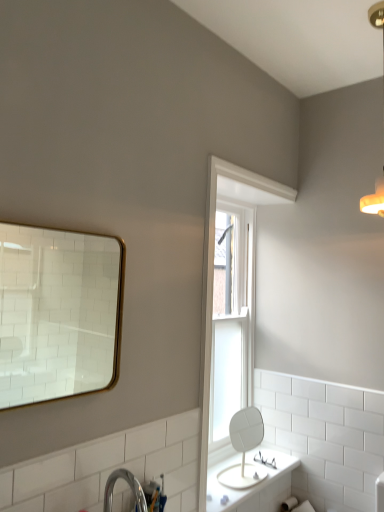
Locate an element on the screen. This screenshot has width=384, height=512. white glossy mirror at center, placed as the 1th mirror when sorted from bottom to top is located at coordinates (244, 448).

Measure the distance between clear plastic glasses at center and camera.

A distance of 7.28 feet exists between clear plastic glasses at center and camera.

Locate an element on the screen. The width and height of the screenshot is (384, 512). white glossy mirror at center, placed as the 1th mirror when sorted from bottom to top is located at coordinates (244, 448).

Is warm matte light fixture at upper right taller or shorter than gold-framed mirror at upper left, arranged as the 2th mirror when viewed from the right?

Clearly, warm matte light fixture at upper right is taller compared to gold-framed mirror at upper left, arranged as the 2th mirror when viewed from the right.

From the image's perspective, who appears lower, warm matte light fixture at upper right or gold-framed mirror at upper left, the 2th mirror in the bottom-to-top sequence?

gold-framed mirror at upper left, the 2th mirror in the bottom-to-top sequence, is shown below in the image.

Can you confirm if warm matte light fixture at upper right is wider than gold-framed mirror at upper left, arranged as the first mirror when viewed from the front?

Yes.

Would you say warm matte light fixture at upper right is inside or outside gold-framed mirror at upper left, arranged as the 2th mirror when viewed from the right?

The correct answer is: outside.

Where is `window above the white glossy mirror at center, acting as the 2th mirror starting from the top (from the image's perspective)`? The height and width of the screenshot is (512, 384). window above the white glossy mirror at center, acting as the 2th mirror starting from the top (from the image's perspective) is located at coordinates (233, 329).

Is clear glass window at center positioned behind white glossy mirror at center, acting as the 2th mirror starting from the top?

Yes, it is behind white glossy mirror at center, acting as the 2th mirror starting from the top.

Is clear glass window at center next to white glossy mirror at center, the 2th mirror from the front?

There is a gap between clear glass window at center and white glossy mirror at center, the 2th mirror from the front.

From the image's perspective, which one is positioned higher, clear glass window at center or white glossy mirror at center, the second mirror when ordered from left to right?

clear glass window at center appears higher in the image.

In the image, is clear glass window at center positioned in front of or behind gold-framed mirror at upper left, arranged as the first mirror when viewed from the front?

clear glass window at center is behind gold-framed mirror at upper left, arranged as the first mirror when viewed from the front.

In the scene shown: From the image's perspective, between clear glass window at center and gold-framed mirror at upper left, arranged as the 2th mirror when viewed from the right, who is located below?

clear glass window at center is shown below in the image.

Considering the relative positions of clear glass window at center and gold-framed mirror at upper left, arranged as the 2th mirror when viewed from the right, in the image provided, is clear glass window at center to the left or to the right of gold-framed mirror at upper left, arranged as the 2th mirror when viewed from the right,?

Clearly, clear glass window at center is on the right of gold-framed mirror at upper left, arranged as the 2th mirror when viewed from the right, in the image.

Is clear glass window at center touching gold-framed mirror at upper left, arranged as the first mirror when viewed from the front?

No, clear glass window at center is not next to gold-framed mirror at upper left, arranged as the first mirror when viewed from the front.

From the image's perspective, is gold-framed mirror at upper left, the 1th mirror when ordered from left to right, positioned above or below clear plastic glasses at center?

From the image's perspective, gold-framed mirror at upper left, the 1th mirror when ordered from left to right, appears above clear plastic glasses at center.

How much distance is there between gold-framed mirror at upper left, the 1th mirror when ordered from left to right, and clear plastic glasses at center?

They are 6.49 feet apart.

Can you see gold-framed mirror at upper left, the 2th mirror positioned from the back, touching clear plastic glasses at center?

gold-framed mirror at upper left, the 2th mirror positioned from the back, and clear plastic glasses at center are clearly separated.

Is gold-framed mirror at upper left, arranged as the first mirror when viewed from the front, turned away from clear plastic glasses at center?

That's not correct — gold-framed mirror at upper left, arranged as the first mirror when viewed from the front, is not looking away from clear plastic glasses at center.

Is clear plastic glasses at center wider or thinner than gold-framed mirror at upper left, arranged as the 2th mirror when viewed from the right?

Clearly, clear plastic glasses at center has more width compared to gold-framed mirror at upper left, arranged as the 2th mirror when viewed from the right.

From the picture: Considering the relative sizes of clear plastic glasses at center and gold-framed mirror at upper left, the 2th mirror positioned from the back, in the image provided, is clear plastic glasses at center shorter than gold-framed mirror at upper left, the 2th mirror positioned from the back,?

Indeed, clear plastic glasses at center has a lesser height compared to gold-framed mirror at upper left, the 2th mirror positioned from the back.

From the image's perspective, does clear plastic glasses at center appear higher than gold-framed mirror at upper left, the 2th mirror in the bottom-to-top sequence?

No.

The width and height of the screenshot is (384, 512). Identify the location of plumbing fixture directly beneath the gold-framed mirror at upper left, the first mirror from the top (from a real-world perspective). (265, 460).

Is gold-framed mirror at upper left, arranged as the 2th mirror when viewed from the right, positioned before white painted wood window frame at upper center?

Yes, it is in front of white painted wood window frame at upper center.

Between gold-framed mirror at upper left, arranged as the 2th mirror when viewed from the right, and white painted wood window frame at upper center, which one appears on the right side from the viewer's perspective?

white painted wood window frame at upper center is more to the right.

How many degrees apart are the facing directions of gold-framed mirror at upper left, arranged as the 2th mirror when viewed from the right, and white painted wood window frame at upper center?

They differ by 0.0964 degrees in their facing directions.

Image resolution: width=384 pixels, height=512 pixels. What are the coordinates of `mirror lying above the white painted wood window frame at upper center (from the image's perspective)` in the screenshot? It's located at (58, 313).

Would you consider clear plastic glasses at center to be distant from warm matte light fixture at upper right?

Yes, clear plastic glasses at center is far from warm matte light fixture at upper right.

Is clear plastic glasses at center at the left side of warm matte light fixture at upper right?

Yes.

Is clear plastic glasses at center completely or partially outside of warm matte light fixture at upper right?

Yes.

Based on the photo, does clear plastic glasses at center have a smaller size compared to warm matte light fixture at upper right?

Yes, clear plastic glasses at center is smaller than warm matte light fixture at upper right.

This screenshot has height=512, width=384. I want to click on light fixture located above the gold-framed mirror at upper left, arranged as the first mirror when viewed from the front (from the image's perspective), so click(x=383, y=127).

Where is `window above the white glossy mirror at center, placed as the 1th mirror when sorted from bottom to top (from a real-world perspective)`? window above the white glossy mirror at center, placed as the 1th mirror when sorted from bottom to top (from a real-world perspective) is located at coordinates (233, 329).

Which object lies further to the anchor point white glossy mirror at center, placed as the 1th mirror when sorted from bottom to top, warm matte light fixture at upper right or clear plastic glasses at center?

warm matte light fixture at upper right is positioned further to the anchor white glossy mirror at center, placed as the 1th mirror when sorted from bottom to top.

Estimate the real-world distances between objects in this image. Which object is further from white painted wood window frame at upper center, clear glass window at center or warm matte light fixture at upper right?

warm matte light fixture at upper right is positioned further to the anchor white painted wood window frame at upper center.

Based on their spatial positions, is clear glass window at center or clear plastic glasses at center closer to warm matte light fixture at upper right?

clear glass window at center is closer to warm matte light fixture at upper right.

Based on their spatial positions, is clear plastic glasses at center or white painted wood window frame at upper center closer to gold-framed mirror at upper left, the 1th mirror when ordered from left to right?

white painted wood window frame at upper center is closer to gold-framed mirror at upper left, the 1th mirror when ordered from left to right.

Which object lies further to the anchor point gold-framed mirror at upper left, arranged as the 2th mirror when viewed from the right, warm matte light fixture at upper right or clear plastic glasses at center?

The object further to gold-framed mirror at upper left, arranged as the 2th mirror when viewed from the right, is warm matte light fixture at upper right.

When comparing their distances from clear glass window at center, does warm matte light fixture at upper right or white glossy mirror at center, acting as the 2th mirror starting from the top, seem further?

The object further to clear glass window at center is warm matte light fixture at upper right.

From the image, which object appears to be farther from gold-framed mirror at upper left, the 1th mirror when ordered from left to right, warm matte light fixture at upper right or white painted wood window frame at upper center?

warm matte light fixture at upper right is further to gold-framed mirror at upper left, the 1th mirror when ordered from left to right.

In the scene shown: Which object lies further to the anchor point white glossy mirror at center, the 1th mirror when ordered from back to front, clear plastic glasses at center or gold-framed mirror at upper left, the 1th mirror when ordered from left to right?

The object further to white glossy mirror at center, the 1th mirror when ordered from back to front, is gold-framed mirror at upper left, the 1th mirror when ordered from left to right.

What are the coordinates of `window between gold-framed mirror at upper left, arranged as the 2th mirror when viewed from the right, and warm matte light fixture at upper right, in the horizontal direction` in the screenshot? It's located at (233, 329).

Where is `window between warm matte light fixture at upper right and white glossy mirror at center, placed as the 1th mirror when sorted from bottom to top, in the vertical direction`? The height and width of the screenshot is (512, 384). window between warm matte light fixture at upper right and white glossy mirror at center, placed as the 1th mirror when sorted from bottom to top, in the vertical direction is located at coordinates (233, 329).

Locate an element on the screen. This screenshot has height=512, width=384. mirror between gold-framed mirror at upper left, the 2th mirror positioned from the back, and clear plastic glasses at center from front to back is located at coordinates (244, 448).

This screenshot has height=512, width=384. Identify the location of window frame located between gold-framed mirror at upper left, the first mirror from the top, and white glossy mirror at center, acting as the 2th mirror starting from the top, in the depth direction. (212, 289).